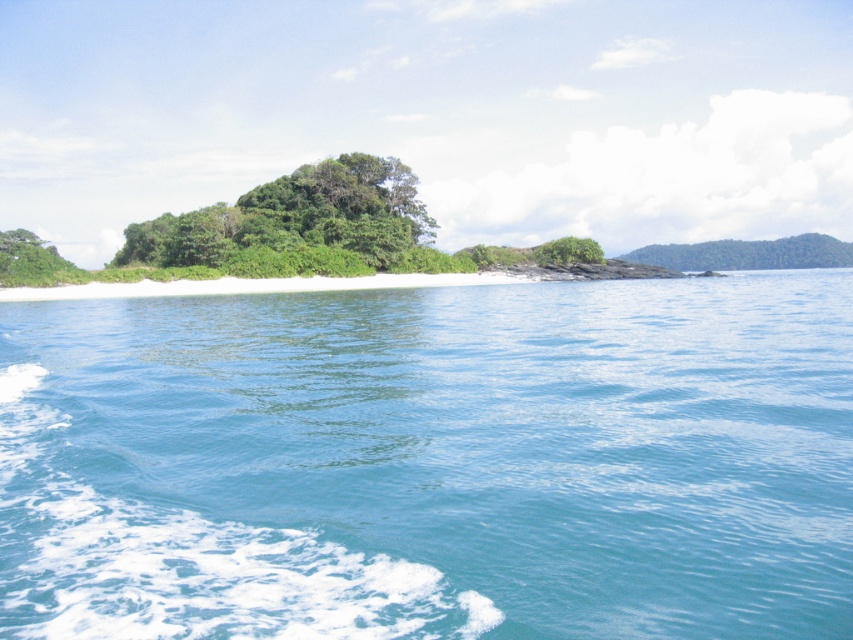
You are standing on the boat and looking at the coastal scene. You notice two points marked in the image. Which point, point [581,467] or point [595,257], is closer to you?

Point [581,467] is closer to the viewer than point [595,257].

You are standing on the boat and looking at the scene. There is a point marked at coordinates (432, 461). What color is the object at that point?

The point at coordinates (432, 461) corresponds to clear blue water at center, which is blue in color.

Based on the photo, you are standing on a boat and looking at the clear blue water at center and the green leafy bush at center. Which object is located to the right side?

The green leafy bush at center is located to the right side of the clear blue water at center.